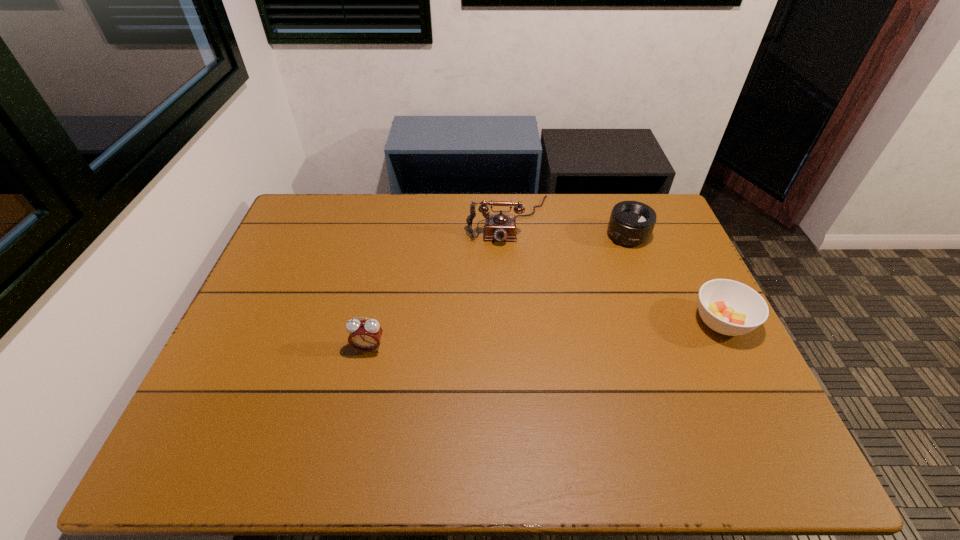
Identify the location of the leftmost object. (364, 335).

You are a GUI agent. You are given a task and a screenshot of the screen. Output one action in this format:
    pyautogui.click(x=<x>, y=<y>)
    Task: Click on the rightmost object
    
    Given the screenshot: What is the action you would take?
    pyautogui.click(x=728, y=307)

What are the coordinates of `telephone` in the screenshot? It's located at (500, 227).

I want to click on the third object from left to right, so click(631, 223).

The width and height of the screenshot is (960, 540). Find the location of `vacant area situated 0.170m on the clock face of the leftmost object`. vacant area situated 0.170m on the clock face of the leftmost object is located at coordinates (353, 417).

Where is `free space located 0.120m on the back of the rightmost object`? The image size is (960, 540). free space located 0.120m on the back of the rightmost object is located at coordinates (696, 270).

This screenshot has width=960, height=540. I want to click on free space located on the dial of the telephone, so click(x=512, y=322).

You are a GUI agent. You are given a task and a screenshot of the screen. Output one action in this format:
    pyautogui.click(x=<x>, y=<y>)
    Task: Click on the vacant region located on the dial of the telephone
    This screenshot has width=960, height=540.
    Given the screenshot: What is the action you would take?
    click(x=512, y=319)

Where is `free spot located 0.130m on the dial of the telephone`? free spot located 0.130m on the dial of the telephone is located at coordinates (511, 275).

The width and height of the screenshot is (960, 540). In order to click on vacant region located on the side of the second object from right to left with brand markings and control switches in this screenshot , I will do `click(588, 278)`.